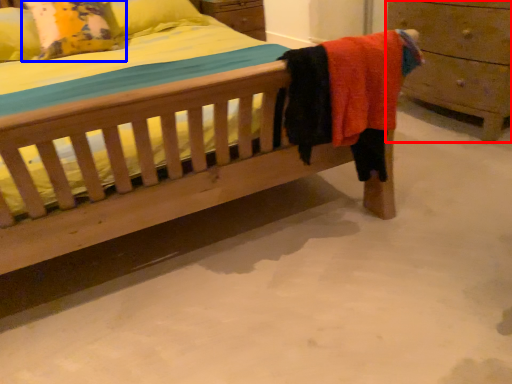
Question: Which of the following is the closest to the observer, chest of drawers (highlighted by a red box) or pillow (highlighted by a blue box)?

Choices:
 (A) chest of drawers
 (B) pillow

Answer: (A)